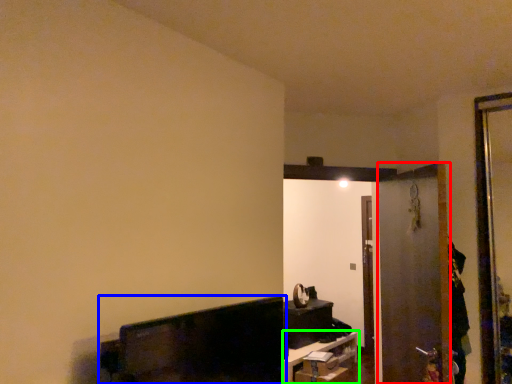
Question: Which object is positioned farthest from screen door (highlighted by a red box)? Select from furniture (highlighted by a blue box) and furniture (highlighted by a green box).

Choices:
 (A) furniture
 (B) furniture

Answer: (B)